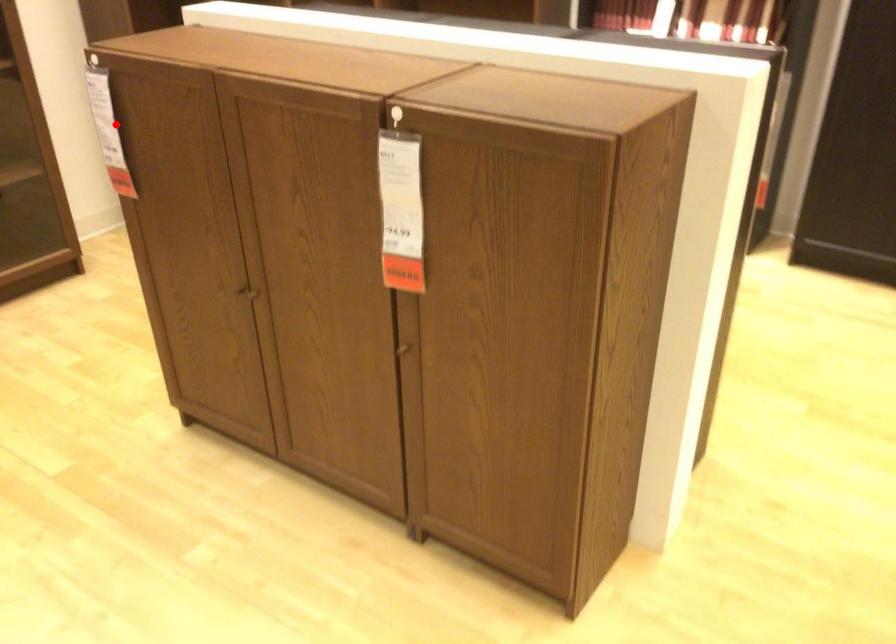
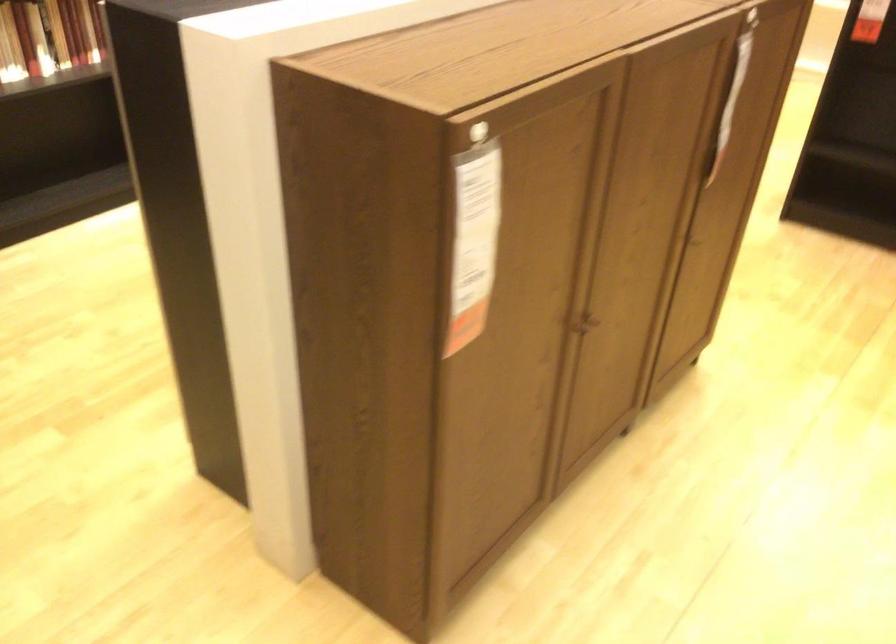
Question: I am providing you with two images of the same scene from different viewpoints. Image1 has a red point marked. In image2, the corresponding 3D location appears at what relative position? Reply with the corresponding letter.

Choices:
 (A) Closer
 (B) Farther

Answer: (A)